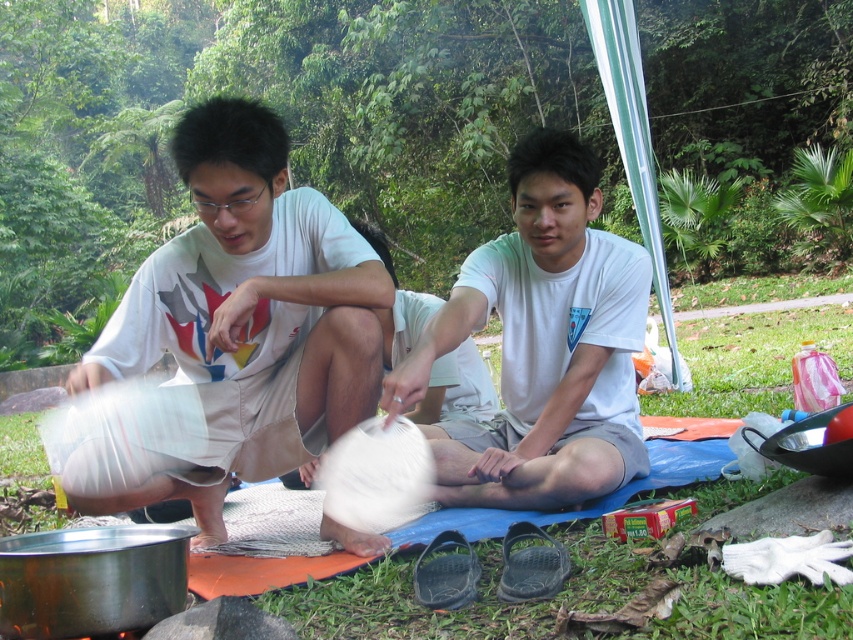
Question: Can you confirm if white cotton shirt at left is positioned below white cotton shirt at center?

Choices:
 (A) yes
 (B) no

Answer: (A)

Question: Can you confirm if white cotton shirt at left is smaller than white cotton shirt at center?

Choices:
 (A) yes
 (B) no

Answer: (A)

Question: Which point appears closest to the camera in this image?

Choices:
 (A) (222, 285)
 (B) (457, 486)

Answer: (A)

Question: Can you confirm if white cotton shirt at left is smaller than white cotton shirt at center?

Choices:
 (A) yes
 (B) no

Answer: (A)

Question: Which point appears closest to the camera in this image?

Choices:
 (A) (109, 365)
 (B) (631, 380)

Answer: (A)